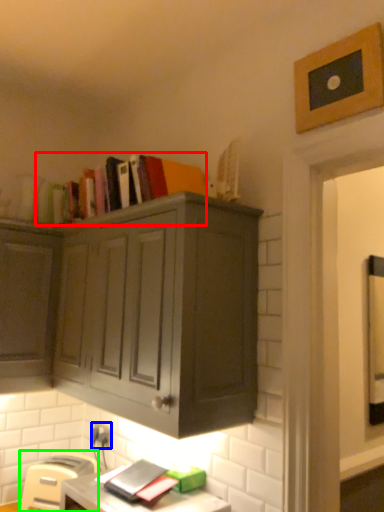
Question: Estimate the real-world distances between objects in this image. Which object is closer to book (highlighted by a red box), electric outlet (highlighted by a blue box) or chair (highlighted by a green box)?

Choices:
 (A) electric outlet
 (B) chair

Answer: (A)